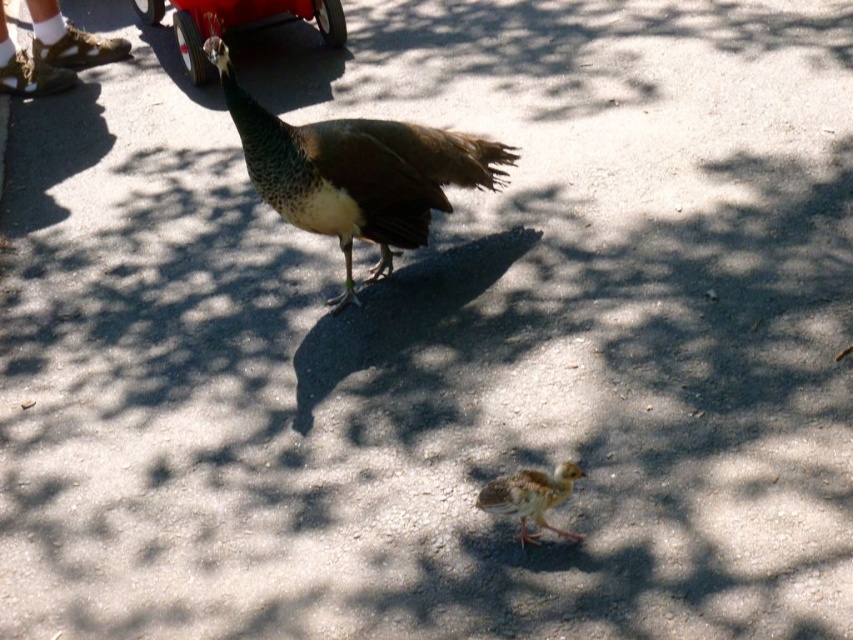
Who is taller, metallic red car at upper left or brown speckled chick at lower center?

metallic red car at upper left is taller.

Looking at this image, is metallic red car at upper left below brown speckled chick at lower center?

Incorrect, metallic red car at upper left is not positioned below brown speckled chick at lower center.

Who is more forward, [178,45] or [582,472]?

Point [582,472]

This screenshot has width=853, height=640. What are the coordinates of `metallic red car at upper left` in the screenshot? It's located at (247, 24).

Which is more to the left, shiny brown peacock at center or brown speckled chick at lower center?

From the viewer's perspective, shiny brown peacock at center appears more on the left side.

At what (x,y) coordinates should I click in order to perform the action: click on shiny brown peacock at center. Please return your answer as a coordinate pair (x, y). Looking at the image, I should click on (354, 172).

Where is `shiny brown peacock at center`? Image resolution: width=853 pixels, height=640 pixels. shiny brown peacock at center is located at coordinates (354, 172).

Who is positioned more to the left, shiny brown peacock at center or metallic red car at upper left?

From the viewer's perspective, metallic red car at upper left appears more on the left side.

Does point (256, 129) lie behind point (300, 13)?

No, (256, 129) is closer to viewer.

Between point (447, 182) and point (171, 17), which one is positioned behind?

Positioned behind is point (171, 17).

Locate an element on the screen. The image size is (853, 640). shiny brown peacock at center is located at coordinates (354, 172).